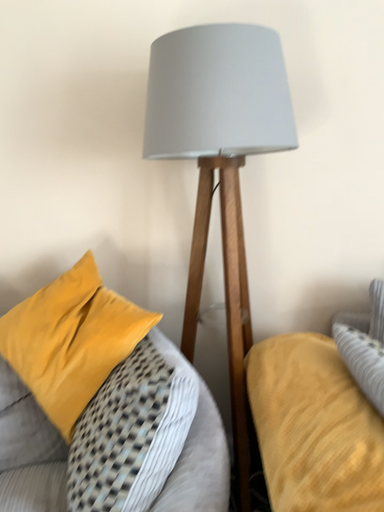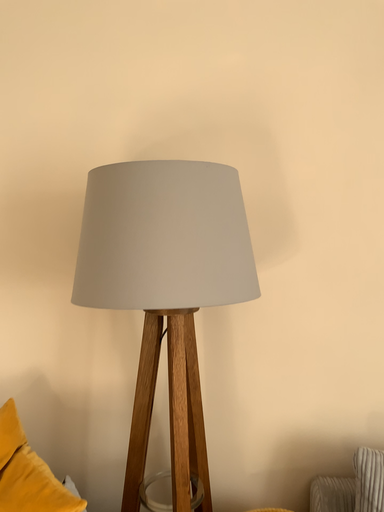
Question: How did the camera likely rotate when shooting the video?

Choices:
 (A) rotated downward
 (B) rotated upward

Answer: (B)